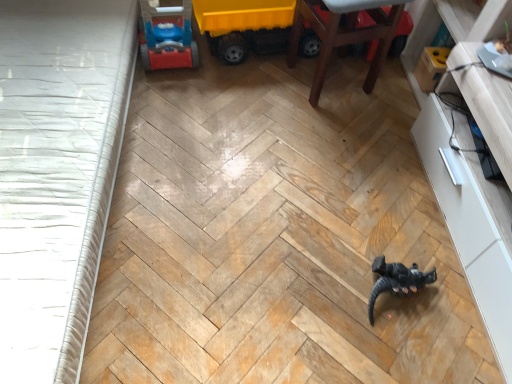
Question: In terms of width, does yellow plastic toy truck at upper center, acting as the first toy starting from the top, look wider or thinner when compared to white glossy dresser at right?

Choices:
 (A) wide
 (B) thin

Answer: (B)

Question: In the image, is yellow plastic toy truck at upper center, which appears as the second toy when viewed from the front, positioned in front of or behind white glossy dresser at right?

Choices:
 (A) front
 (B) behind

Answer: (B)

Question: Which object is positioned closest to the white textured bed frame at left?

Choices:
 (A) black matte dinosaur at center, which is the 2th toy from back to front
 (B) white glossy dresser at right
 (C) yellow plastic toy truck at upper center, which appears as the second toy when viewed from the front
 (D) wooden chair at upper right

Answer: (C)

Question: Estimate the real-world distances between objects in this image. Which object is farther from the white glossy dresser at right?

Choices:
 (A) black matte dinosaur at center, which is the 1th toy in front-to-back order
 (B) white textured bed frame at left
 (C) wooden chair at upper right
 (D) yellow plastic toy truck at upper center, arranged as the 2th toy when ordered from the bottom

Answer: (B)